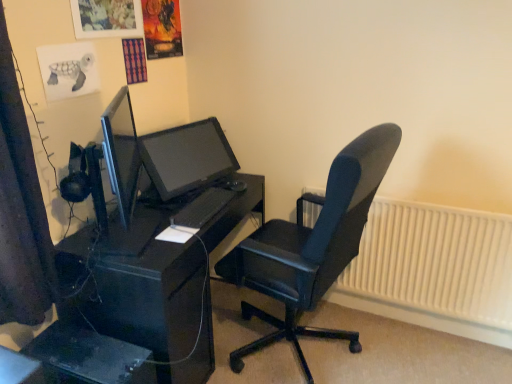
Where is `vacant area located to the right-hand side of black leather office chair at center`? This screenshot has height=384, width=512. vacant area located to the right-hand side of black leather office chair at center is located at coordinates (419, 355).